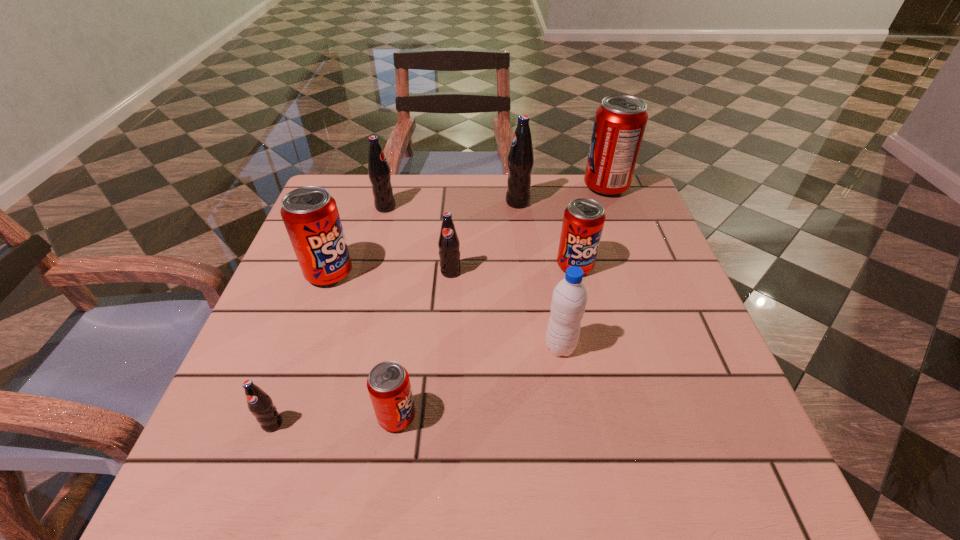
At what (x,y) coordinates should I click in order to perform the action: click on vacant point located 0.200m on the front label of the third soda can from right to left. Please return your answer as a coordinate pair (x, y). Looking at the image, I should click on (429, 202).

What are the coordinates of `vacant space located on the front label of the third smallest black pop` in the screenshot? It's located at (419, 207).

I want to click on free location located on the back of the leftmost red soda can, so click(362, 182).

At what (x,y) coordinates should I click in order to perform the action: click on blank space located 0.250m on the back of the third nearest object. Please return your answer as a coordinate pair (x, y). This screenshot has width=960, height=540. Looking at the image, I should click on (544, 249).

The width and height of the screenshot is (960, 540). I want to click on vacant region located 0.240m on the front label of the fourth soda can from right to left, so click(x=444, y=373).

Locate an element on the screen. The height and width of the screenshot is (540, 960). vacant space located 0.100m on the front of the second soda can from right to left is located at coordinates (586, 313).

The image size is (960, 540). Identify the location of free space located 0.070m on the front label of the nearest black pop. (252, 478).

Find the location of `free space located 0.120m on the back of the third red soda can from right to left`. free space located 0.120m on the back of the third red soda can from right to left is located at coordinates (408, 343).

At what (x,y) coordinates should I click in order to perform the action: click on object that is at the right edge. Please return your answer as a coordinate pair (x, y). The image size is (960, 540). Looking at the image, I should click on (620, 121).

Identify the location of object that is at the far left corner. (379, 173).